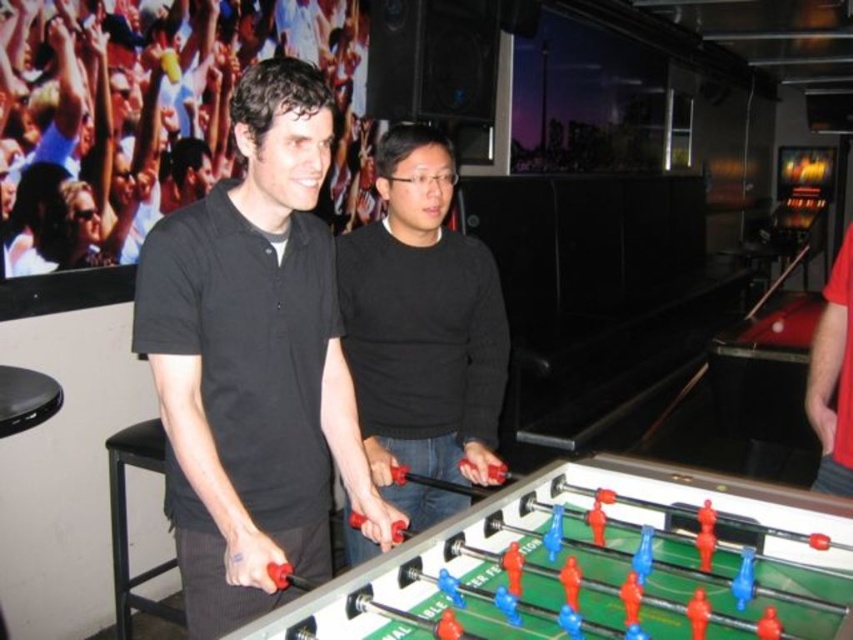
You are a photographer trying to capture a clear shot of both the black matte shirt at upper left and the black matte sweater at center. Which one will appear closer to the camera in the photo?

The black matte shirt at upper left will appear closer to the camera because it is positioned over the black matte sweater at center.

You are standing at the point labeled point [308,33] and want to take a photo of the foosball table. If your camera can focus on objects up to 3 meters away, will it be able to capture the table clearly?

The distance between point [308,33] and the camera is 3.24 meters, which exceeds the camera maximum focusing distance of 3 meters. Therefore, the camera cannot capture the table clearly.

You are a photographer trying to capture a photo of the black matte shirt at upper left and the red fabric sleeve at right. Since you want both subjects to appear in focus, which one should you focus on first to ensure proper depth of field?

The black matte shirt at upper left is much taller than the red fabric sleeve at right, so you should focus on the black matte shirt at upper left first to ensure both are in focus.